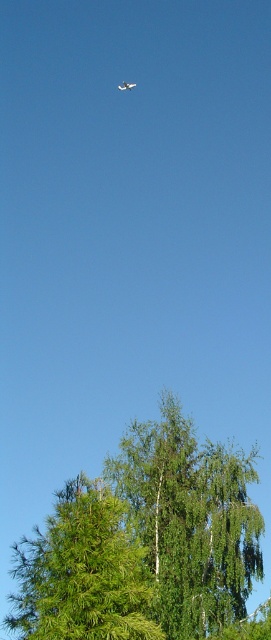
Question: Is green leafy tree at lower center thinner than metallic silver airplane at upper center?

Choices:
 (A) yes
 (B) no

Answer: (B)

Question: Among these points, which one is nearest to the camera?

Choices:
 (A) (91, 544)
 (B) (127, 88)
 (C) (172, 417)

Answer: (A)

Question: Among these points, which one is farthest from the camera?

Choices:
 (A) (152, 563)
 (B) (76, 513)
 (C) (128, 83)

Answer: (C)

Question: Which of these objects is positioned closest to the green leafy tree at center?

Choices:
 (A) metallic silver airplane at upper center
 (B) green leafy tree at lower center

Answer: (B)

Question: Does green leafy tree at lower center have a lesser width compared to metallic silver airplane at upper center?

Choices:
 (A) no
 (B) yes

Answer: (A)

Question: Can you confirm if green leafy tree at lower center is positioned below metallic silver airplane at upper center?

Choices:
 (A) yes
 (B) no

Answer: (A)